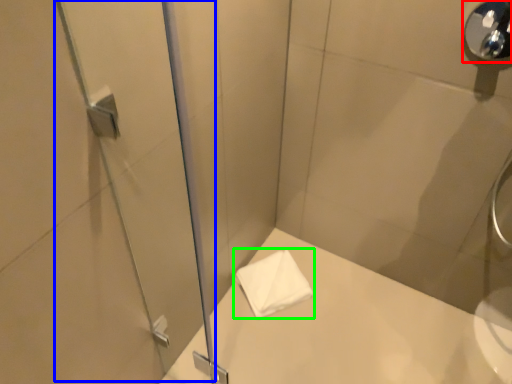
Question: Which object is the farthest from shower (highlighted by a red box)? Choose among these: screen door (highlighted by a blue box) or towel (highlighted by a green box).

Choices:
 (A) screen door
 (B) towel

Answer: (B)